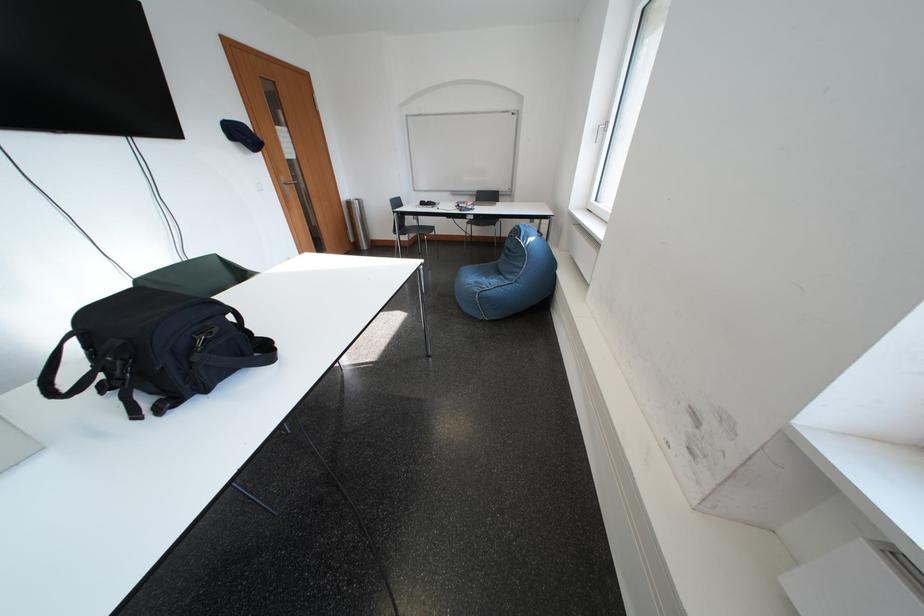
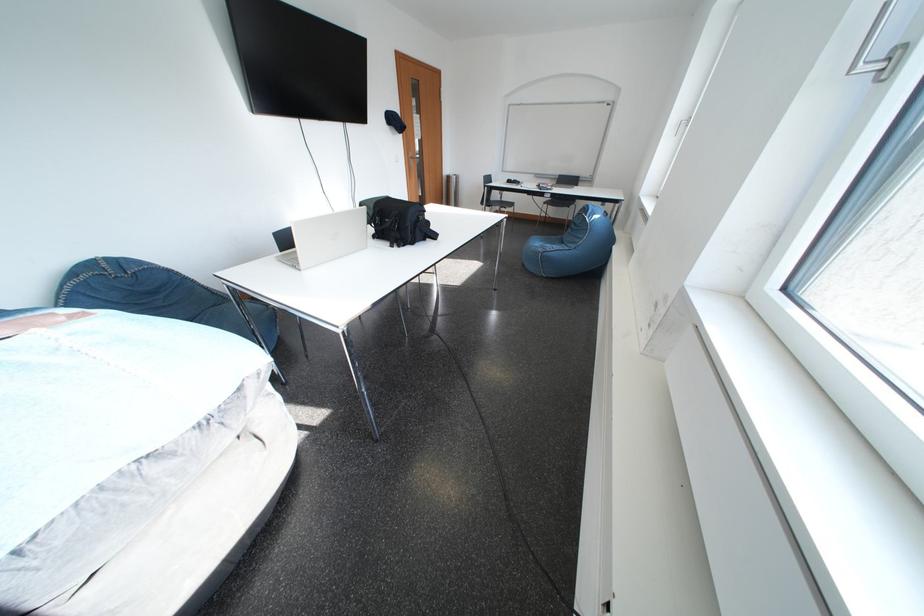
Question: Which direction would the cameraman need to move to produce the second image? Reply with the corresponding letter.

Choices:
 (A) Left
 (B) Right
 (C) Forward
 (D) Backward

Answer: (D)